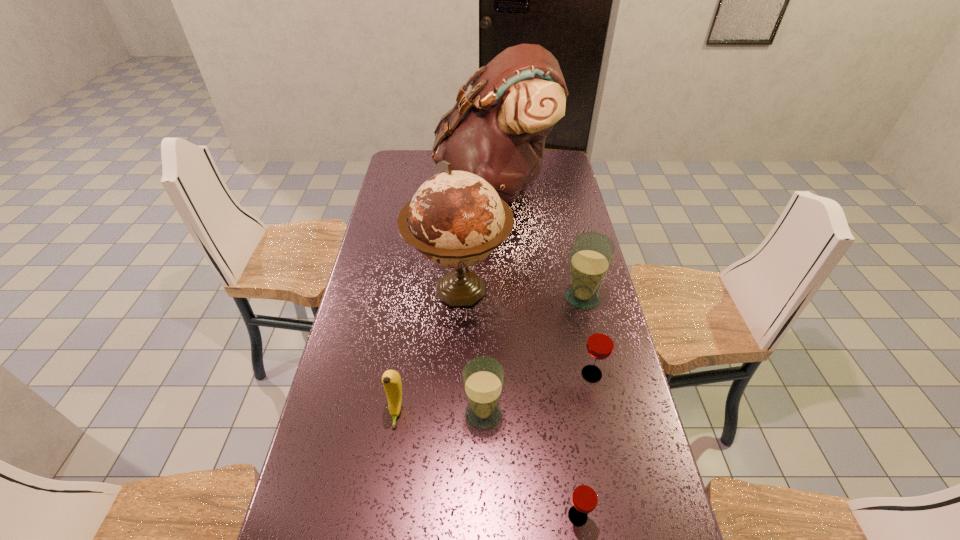
Locate an element on the screen. Image resolution: width=960 pixels, height=540 pixels. free region located on the left of the shortest glass is located at coordinates (413, 516).

At what (x,y) coordinates should I click in order to perform the action: click on object present at the far edge. Please return your answer as a coordinate pair (x, y). Looking at the image, I should click on (497, 131).

What are the coordinates of `satchel that is at the right edge` in the screenshot? It's located at (497, 131).

This screenshot has height=540, width=960. What are the coordinates of `object that is at the far right corner` in the screenshot? It's located at (497, 131).

In the image, there is a desktop. At what (x,y) coordinates should I click in order to perform the action: click on vacant space at the left edge. Please return your answer as a coordinate pair (x, y). The image size is (960, 540). Looking at the image, I should click on [365, 476].

At what (x,y) coordinates should I click in order to perform the action: click on vacant region at the right edge. Please return your answer as a coordinate pair (x, y). The image size is (960, 540). Looking at the image, I should click on (634, 402).

In the image, there is a desktop. Where is `vacant space at the far left corner`? Image resolution: width=960 pixels, height=540 pixels. vacant space at the far left corner is located at coordinates (413, 168).

Find the location of a particular element. The image size is (960, 540). vacant space in between the globe and the smaller red glass is located at coordinates (518, 403).

Find the location of a particular element. free space between the third farthest glass and the sixth shortest object is located at coordinates (471, 352).

This screenshot has height=540, width=960. In order to click on free space between the third nearest glass and the tallest object in this screenshot , I will do `click(542, 281)`.